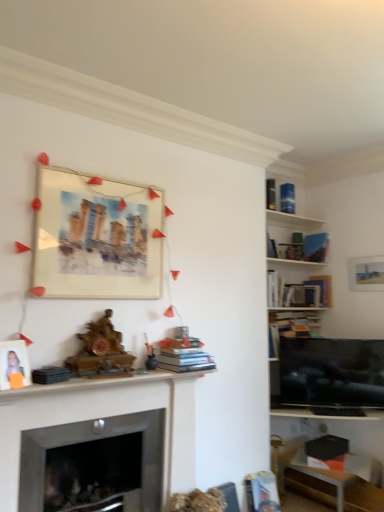
I want to click on empty space that is ontop of watercolor paper painting at upper left, marked as the 1th picture frame in a top-to-bottom arrangement (from a real-world perspective), so click(105, 177).